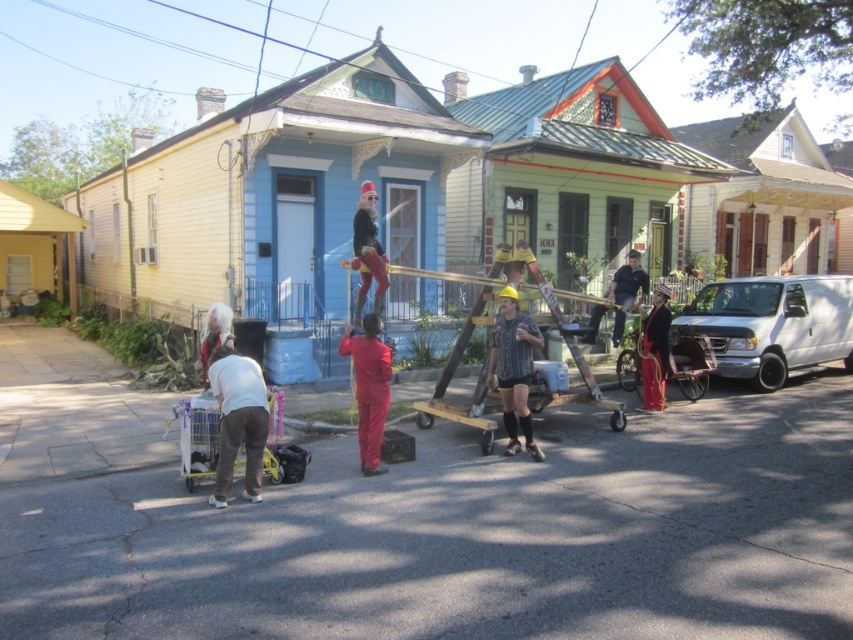
Between point (593, 396) and point (621, 269), which one is positioned in front?

Positioned in front is point (593, 396).

Who is more distant from viewer, (582, 390) or (628, 278)?

The point (628, 278) is behind.

The width and height of the screenshot is (853, 640). Describe the element at coordinates (488, 360) in the screenshot. I see `wooden at center` at that location.

At what (x,y) coordinates should I click in order to perform the action: click on wooden at center. Please return your answer as a coordinate pair (x, y). This screenshot has width=853, height=640. Looking at the image, I should click on (488, 360).

Which is below, striped shirt at center or dark blue jeans at center?

Positioned lower is striped shirt at center.

Between point (514, 337) and point (608, 289), which one is positioned in front?

Positioned in front is point (514, 337).

Find the location of a particular element. This screenshot has height=640, width=853. striped shirt at center is located at coordinates (514, 369).

Can you confirm if wooden at center is bigger than striped shirt at center?

Indeed, wooden at center has a larger size compared to striped shirt at center.

Does wooden at center have a greater height compared to striped shirt at center?

Yes, wooden at center is taller than striped shirt at center.

I want to click on wooden at center, so click(x=488, y=360).